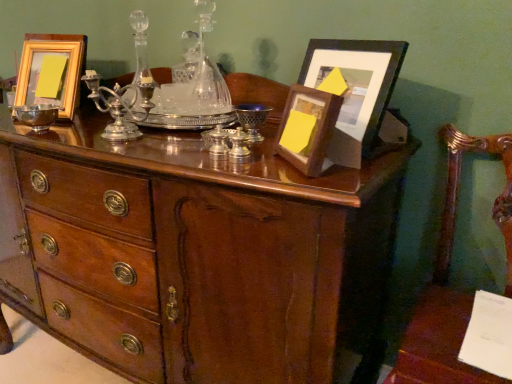
This screenshot has height=384, width=512. Find the location of `free location in front of silver metallic candle holder at center, the second candle holder positioned from the front`. free location in front of silver metallic candle holder at center, the second candle holder positioned from the front is located at coordinates (230, 173).